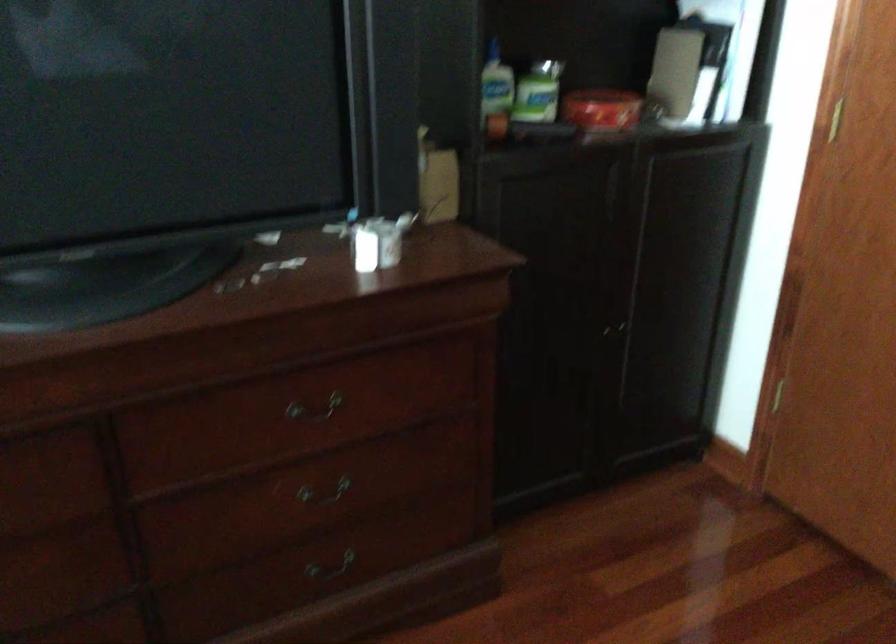
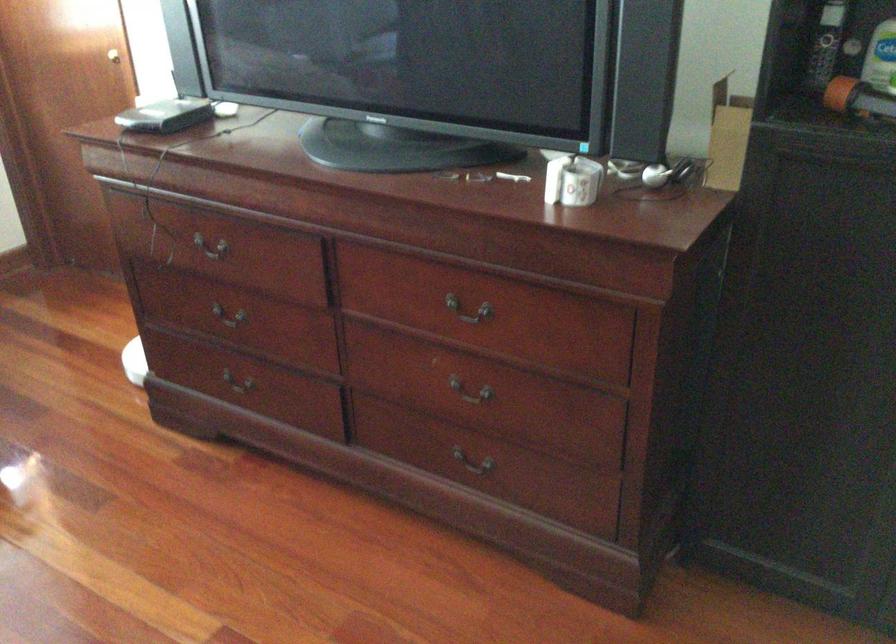
Where in the second image is the point corresponding to pixel 485 105 from the first image?

(883, 77)